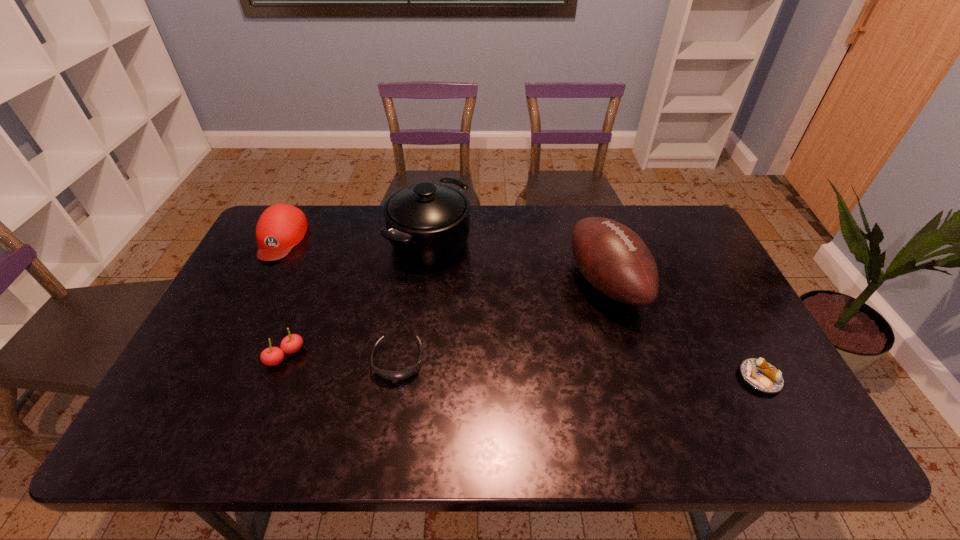
At what (x,y) coordinates should I click in order to perform the action: click on saucepan. Please return your answer as a coordinate pair (x, y). The image size is (960, 540). Looking at the image, I should click on (428, 223).

This screenshot has height=540, width=960. What are the coordinates of `the fifth object from left to right` in the screenshot? It's located at (614, 259).

Where is `baseball cap`? The width and height of the screenshot is (960, 540). baseball cap is located at coordinates (281, 227).

In order to click on the leftmost object in this screenshot , I will do `click(281, 227)`.

Find the location of `cherry`. cherry is located at coordinates tap(272, 356).

At what (x,y) coordinates should I click in order to perform the action: click on the fourth tallest object. Please return your answer as a coordinate pair (x, y). Looking at the image, I should click on (272, 356).

The image size is (960, 540). In order to click on the fifth tallest object in this screenshot , I will do tap(406, 373).

Locate an element on the screen. This screenshot has height=540, width=960. the shortest object is located at coordinates (763, 376).

Where is `pastry`? The height and width of the screenshot is (540, 960). pastry is located at coordinates (763, 376).

Locate an element on the screen. This screenshot has width=960, height=540. free space located on the left of the saucepan is located at coordinates (298, 241).